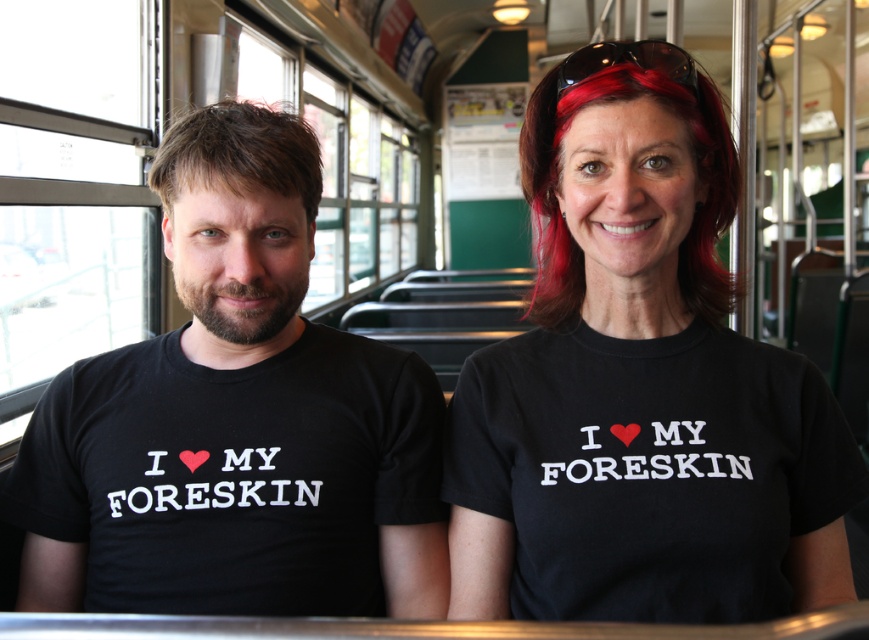
What are the coordinates of the red dyed hair at upper center in the image?

The coordinates of the red dyed hair at upper center are at point (556, 177).

You are a photographer standing in the aisle of a bus or tram. You want to take a closeup photo of the red dyed hair at upper center. The camera you are using has a minimum focusing distance of 70 centimeters. Can you take the photo without moving closer than 70 centimeters?

The distance between the red dyed hair at upper center and the camera is 88.02 centimeters, which is greater than the minimum focusing distance of 70 centimeters. Therefore, you can take the closeup photo without moving closer than 70 centimeters.